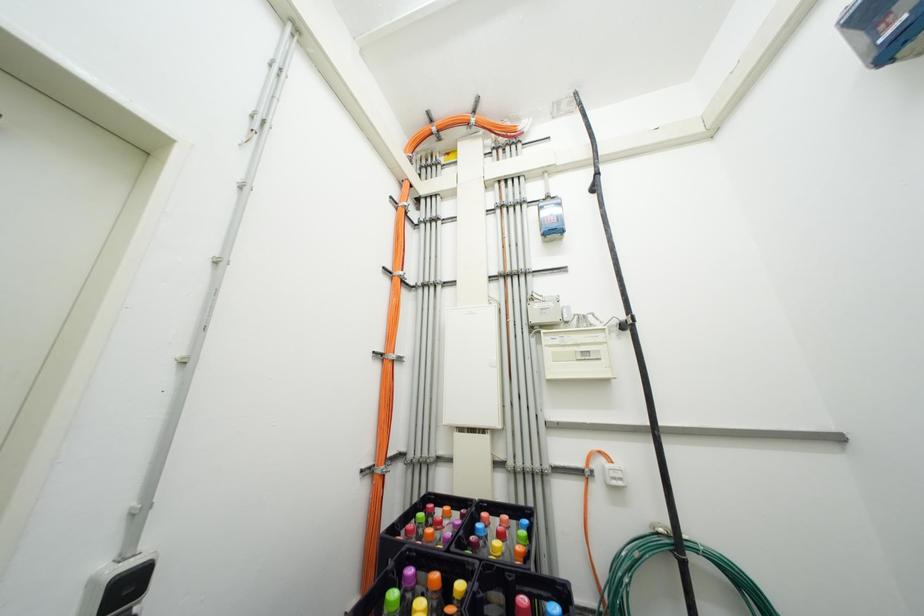
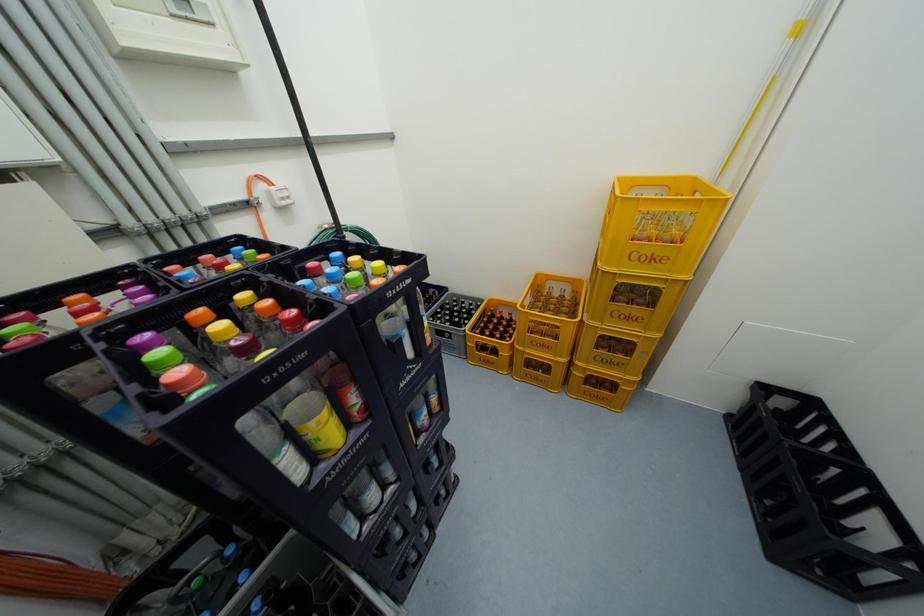
Consider the image. Based on the continuous images, in which direction is the camera rotating?

The rotation direction of the camera is right-down.